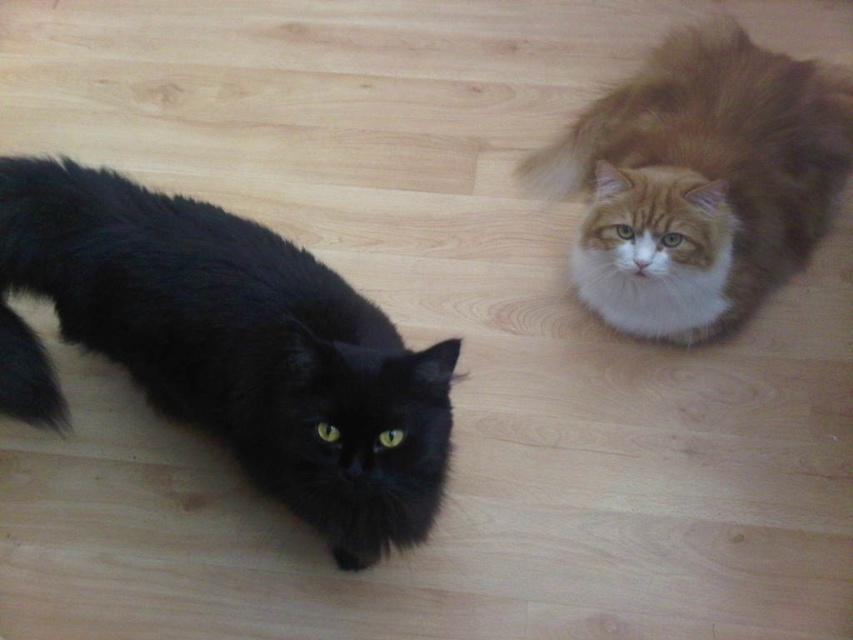
Can you confirm if black fluffy cat at left is positioned above fluffy brown cat at upper right?

No.

Can you confirm if black fluffy cat at left is positioned to the left of fluffy brown cat at upper right?

Correct, you'll find black fluffy cat at left to the left of fluffy brown cat at upper right.

At what (x,y) coordinates should I click in order to perform the action: click on black fluffy cat at left. Please return your answer as a coordinate pair (x, y). The height and width of the screenshot is (640, 853). Looking at the image, I should click on (229, 348).

Locate an element on the screen. The width and height of the screenshot is (853, 640). black fluffy cat at left is located at coordinates (229, 348).